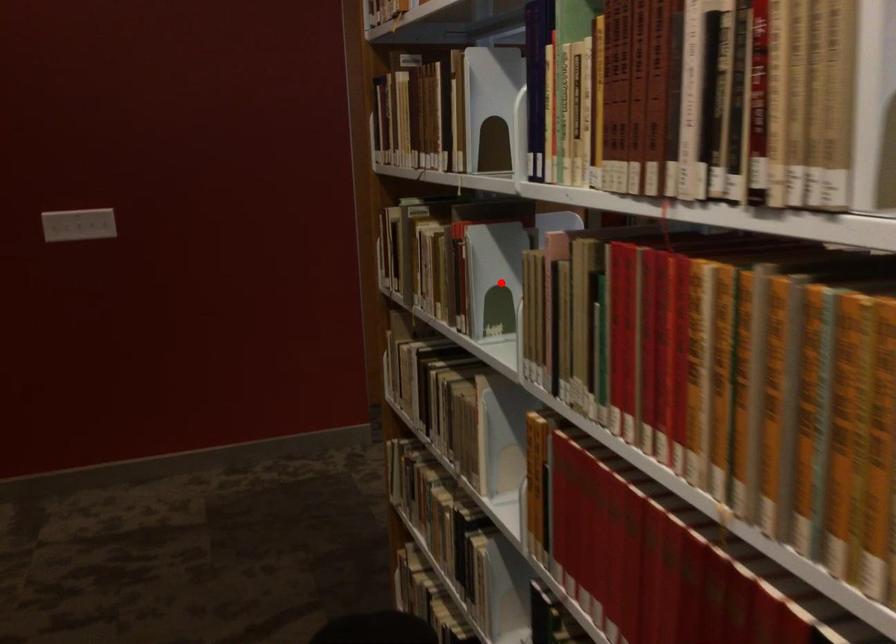
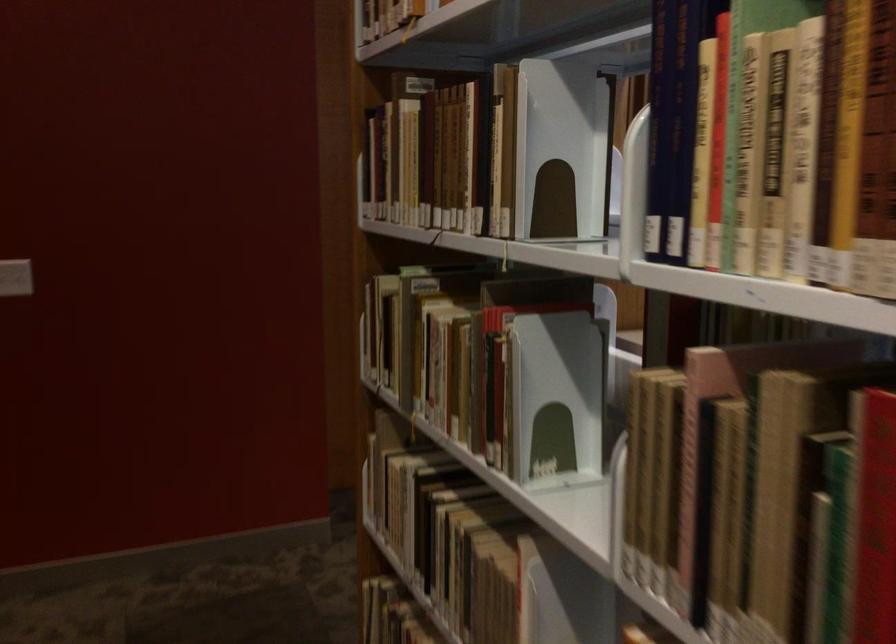
Question: I am providing you with two images of the same scene from different viewpoints. Image1 has a red point marked. In image2, the corresponding 3D location appears at what relative position? Reply with the corresponding letter.

Choices:
 (A) Closer
 (B) Farther

Answer: (A)